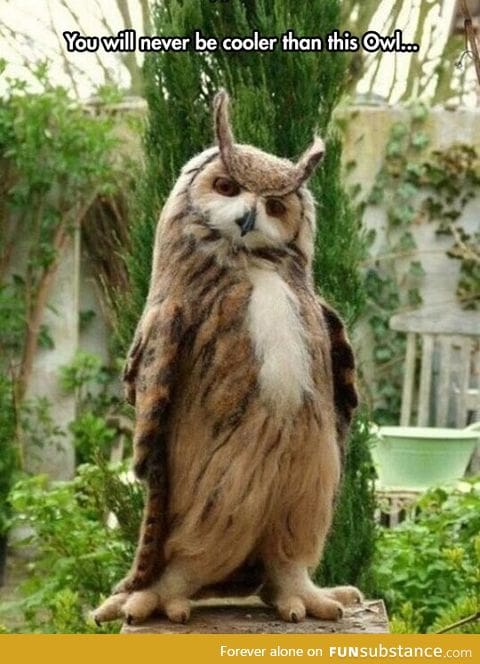
The height and width of the screenshot is (664, 480). I want to click on chair, so click(x=443, y=382).